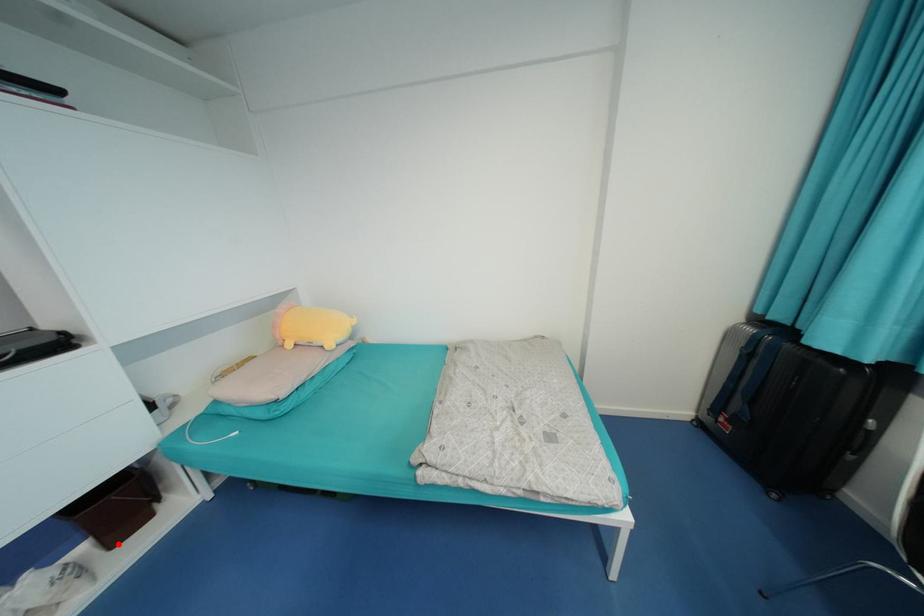
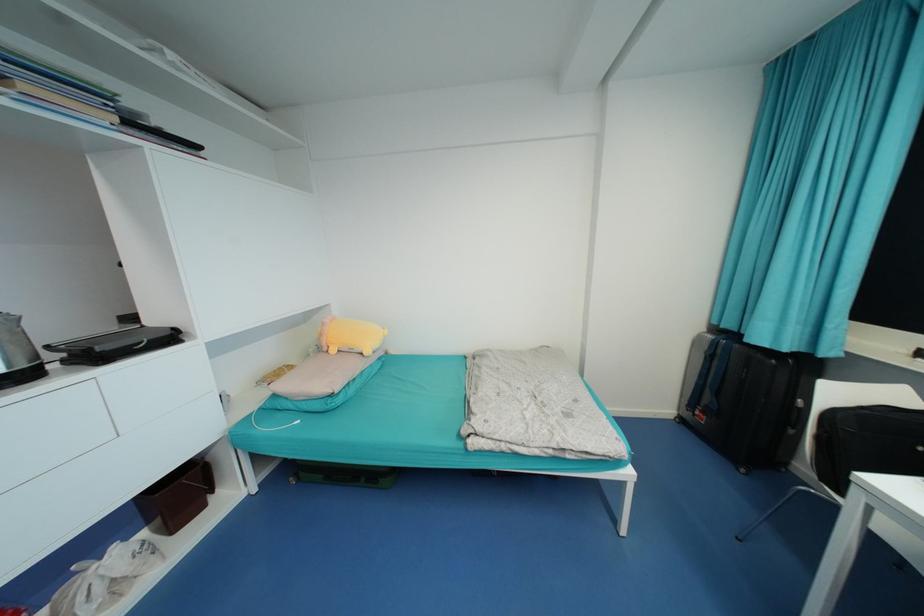
Locate, in the second image, the point that corresponds to the highlighted location in the first image.

(177, 530)